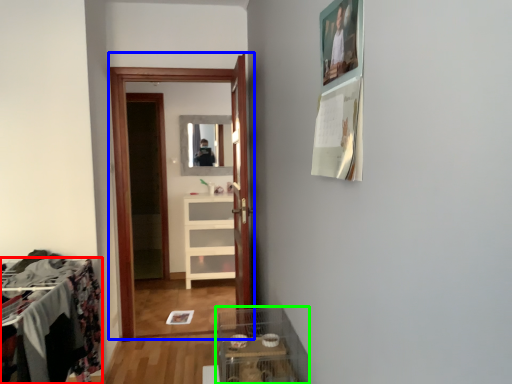
Question: Which is nearer to the furniture (highlighted by a red box)? clothing store (highlighted by a blue box) or glass box (highlighted by a green box).

Choices:
 (A) clothing store
 (B) glass box

Answer: (B)